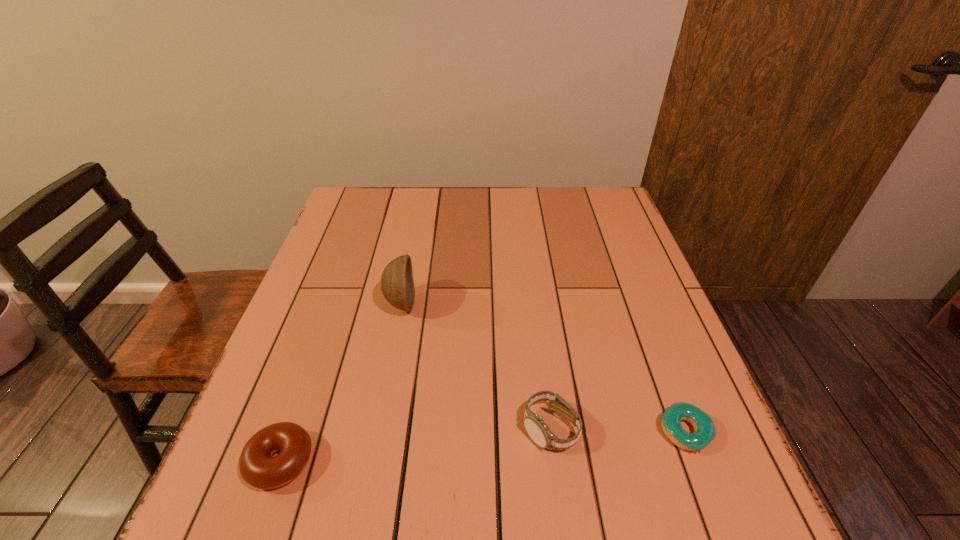
In the image, there is a desktop. Where is `vacant space at the far right corner`? vacant space at the far right corner is located at coordinates (591, 198).

In the image, there is a desktop. At what (x,y) coordinates should I click in order to perform the action: click on vacant space at the near right corner. Please return your answer as a coordinate pair (x, y). This screenshot has width=960, height=540. Looking at the image, I should click on (655, 509).

At what (x,y) coordinates should I click in order to perform the action: click on vacant space that's between the left doughnut and the tallest object. Please return your answer as a coordinate pair (x, y). The image size is (960, 540). Looking at the image, I should click on (341, 382).

Find the location of a particular element. The width and height of the screenshot is (960, 540). blank region between the right doughnut and the tallest object is located at coordinates (542, 368).

Image resolution: width=960 pixels, height=540 pixels. I want to click on empty space between the second tallest object and the farthest object, so tap(475, 366).

Locate an element on the screen. The height and width of the screenshot is (540, 960). empty space that is in between the bowl and the right doughnut is located at coordinates (542, 368).

Where is `blank region between the watch and the left doughnut`? This screenshot has height=540, width=960. blank region between the watch and the left doughnut is located at coordinates (415, 445).

At what (x,y) coordinates should I click in order to perform the action: click on unoccupied area between the right doughnut and the third shortest object. Please return your answer as a coordinate pair (x, y). Looking at the image, I should click on (617, 430).

The height and width of the screenshot is (540, 960). In order to click on free space between the watch and the tallest object in this screenshot , I will do `click(475, 366)`.

I want to click on free space between the shortest object and the second object from right to left, so click(617, 430).